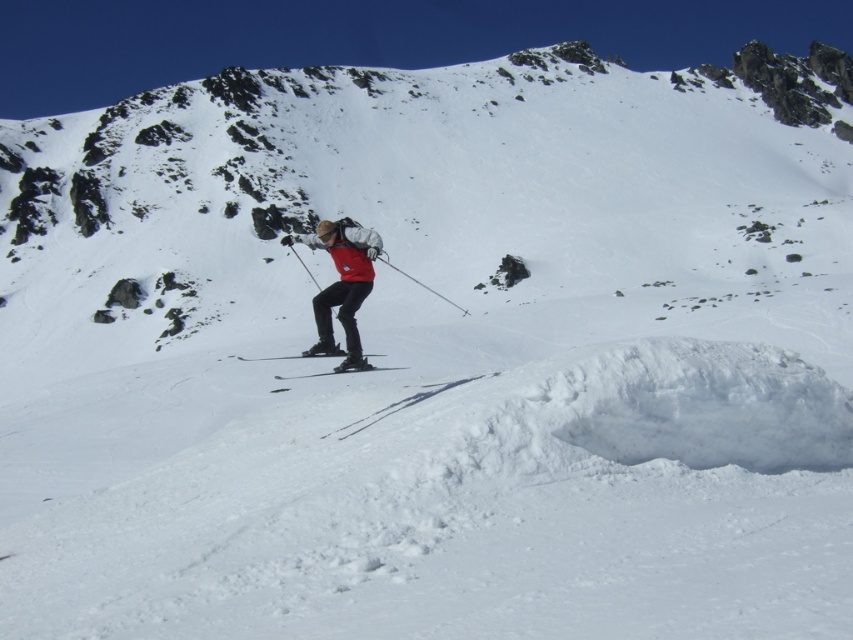
Does matte red jacket at center appear on the left side of matte black skis at center?

Yes, matte red jacket at center is to the left of matte black skis at center.

Image resolution: width=853 pixels, height=640 pixels. Describe the element at coordinates (341, 285) in the screenshot. I see `matte red jacket at center` at that location.

Locate an element on the screen. The height and width of the screenshot is (640, 853). matte red jacket at center is located at coordinates (341, 285).

Consider the image. Is matte black ski at center further to the viewer compared to matte black skis at center?

Result: That is True.

You are a GUI agent. You are given a task and a screenshot of the screen. Output one action in this format:
    pyautogui.click(x=<x>, y=<y>)
    Task: Click on the matte black ski at center
    The width and height of the screenshot is (853, 640).
    Given the screenshot: What is the action you would take?
    pyautogui.click(x=337, y=371)

The image size is (853, 640). Identify the location of matte black ski at center. (337, 371).

Is matte red jacket at center to the left of metallic silver ski pole at center from the viewer's perspective?

Yes, matte red jacket at center is to the left of metallic silver ski pole at center.

Can you confirm if matte red jacket at center is positioned below metallic silver ski pole at center?

Incorrect, matte red jacket at center is not positioned below metallic silver ski pole at center.

Between point (323, 225) and point (379, 257), which one is positioned behind?

The point (323, 225) is more distant.

This screenshot has width=853, height=640. I want to click on matte red jacket at center, so click(x=341, y=285).